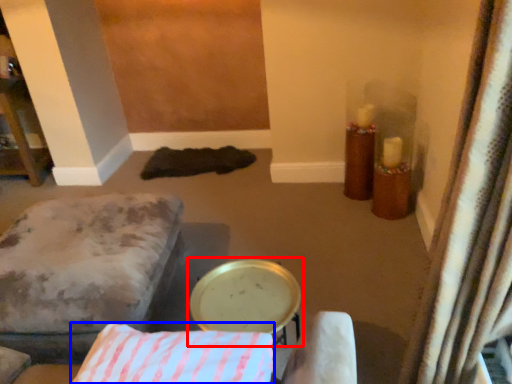
Question: Among these objects, which one is farthest to the camera, round table (highlighted by a red box) or pillow (highlighted by a blue box)?

Choices:
 (A) round table
 (B) pillow

Answer: (A)